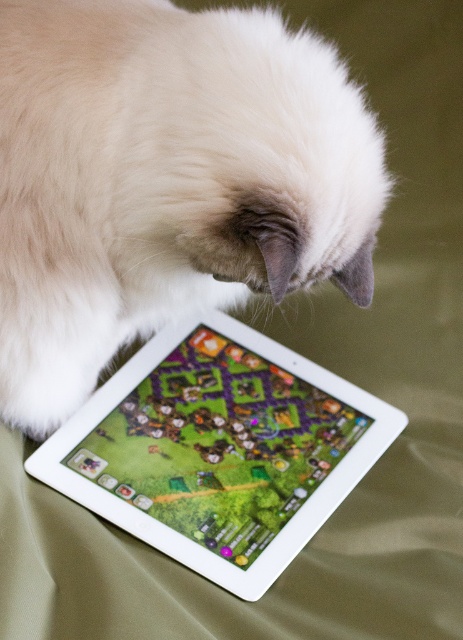
Question: Can you confirm if white fluffy cat at center is positioned to the left of white glossy tablet at upper center?

Choices:
 (A) no
 (B) yes

Answer: (B)

Question: Does white fluffy cat at center have a smaller size compared to white glossy tablet at upper center?

Choices:
 (A) yes
 (B) no

Answer: (B)

Question: Which point is farther to the camera?

Choices:
 (A) (155, 102)
 (B) (100, 397)

Answer: (B)

Question: Which object is closer to the camera taking this photo?

Choices:
 (A) white fluffy cat at center
 (B) white glossy tablet at upper center

Answer: (A)

Question: Is the position of white fluffy cat at center less distant than that of white glossy tablet at upper center?

Choices:
 (A) no
 (B) yes

Answer: (B)